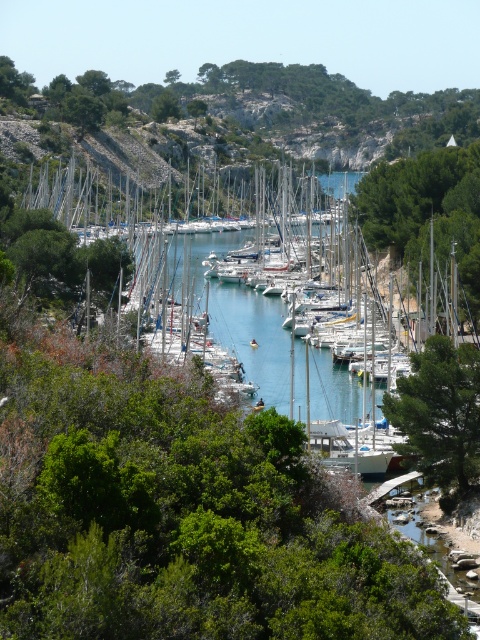
Who is taller, green leafy tree at right or green leafy tree at center?

green leafy tree at right is taller.

You are a GUI agent. You are given a task and a screenshot of the screen. Output one action in this format:
    pyautogui.click(x=<x>, y=<y>)
    Task: Click on the green leafy tree at right
    This screenshot has width=480, height=640.
    Given the screenshot: What is the action you would take?
    pyautogui.click(x=425, y=211)

Is green leafy tree at center above green leafy tree at upper center?

No.

Which is in front, point (470, 352) or point (177, 99)?

Positioned in front is point (470, 352).

Which is in front, point (419, 372) or point (154, 100)?

Point (419, 372)

This screenshot has height=640, width=480. What are the coordinates of `green leafy tree at center` in the screenshot? It's located at (440, 412).

Is green leafy tree at right taller than green leafy tree at upper center?

Correct, green leafy tree at right is much taller as green leafy tree at upper center.

Which is behind, point (453, 202) or point (162, 97)?

The point (162, 97) is more distant.

Who is more distant from viewer, [422,186] or [164,109]?

Point [164,109]

I want to click on green leafy tree at right, so click(425, 211).